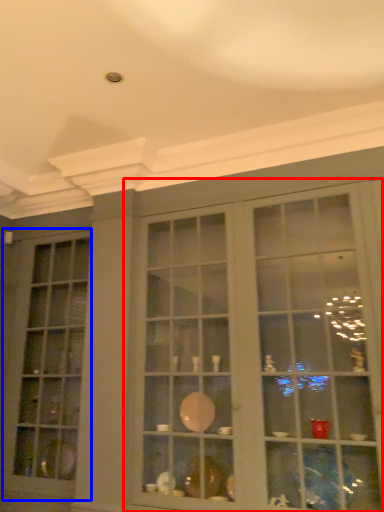
Question: Among these objects, which one is farthest to the camera, shelf (highlighted by a red box) or window (highlighted by a blue box)?

Choices:
 (A) shelf
 (B) window

Answer: (B)